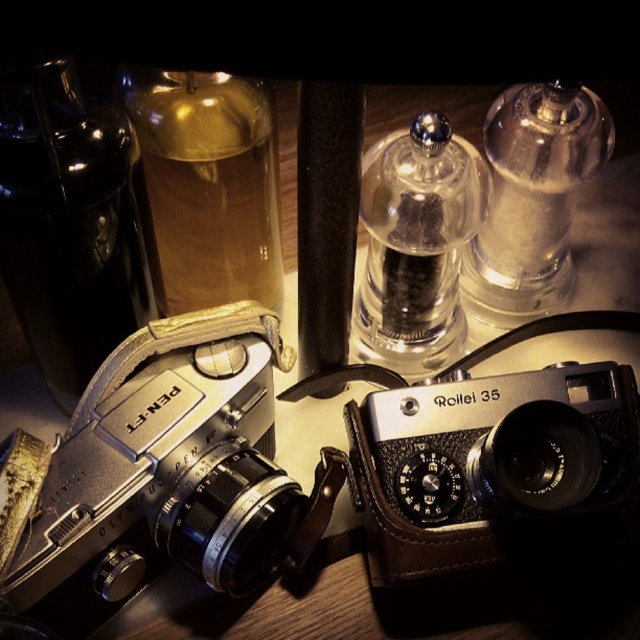
Who is higher up, matte black camera at center or translucent glass bottle at upper left?

translucent glass bottle at upper left

Does matte black camera at center have a larger size compared to translucent glass bottle at upper left?

Yes.

Is point (556, 420) farther from viewer compared to point (172, 228)?

No, it is not.

Locate an element on the screen. matte black camera at center is located at coordinates (492, 465).

Which is more to the left, black glass bottle at left or translucent glass bottle at upper left?

black glass bottle at left is more to the left.

Between point (102, 339) and point (211, 120), which one is positioned in front?

Positioned in front is point (211, 120).

Who is more forward, (106, 268) or (161, 116)?

Point (106, 268) is in front.

Find the location of a particular element. black glass bottle at left is located at coordinates (70, 224).

Between black glass bottle at left and transparent glass bottle at upper center, which one appears on the left side from the viewer's perspective?

Positioned to the left is black glass bottle at left.

Is black glass bottle at left in front of transparent glass bottle at upper center?

Yes, black glass bottle at left is closer to the viewer.

Locate an element on the screen. The height and width of the screenshot is (640, 640). black glass bottle at left is located at coordinates (70, 224).